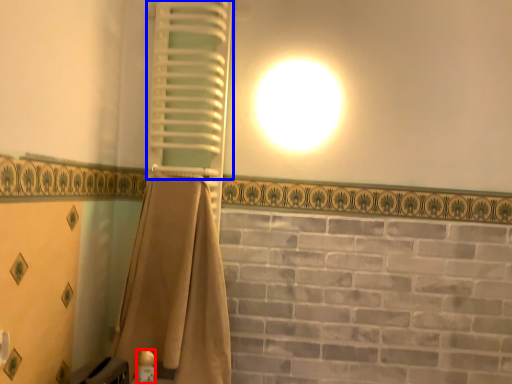
Question: Among these objects, which one is farthest to the camera, toiletry (highlighted by a red box) or shutter (highlighted by a blue box)?

Choices:
 (A) toiletry
 (B) shutter

Answer: (B)